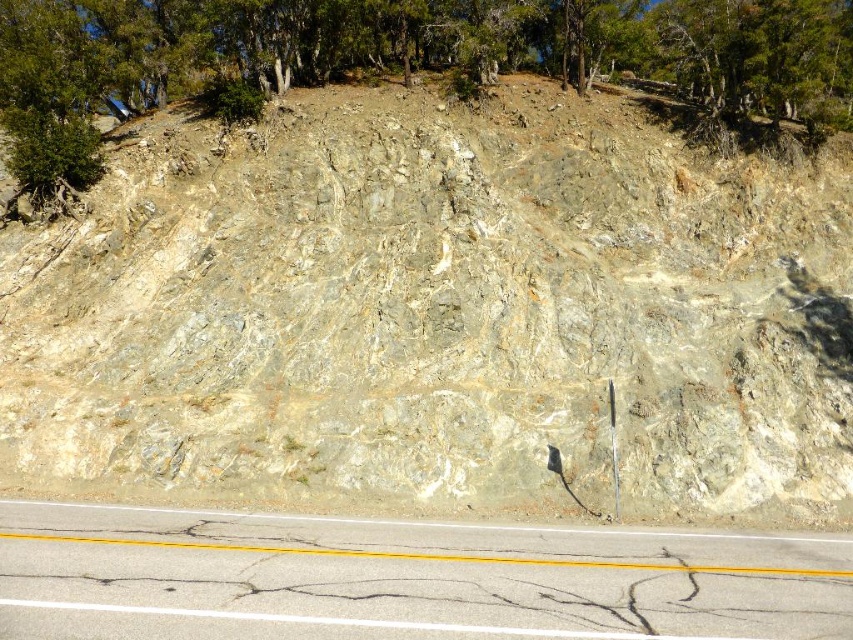
You are a hiker trying to navigate a rocky hillside. You see a gray rock at center and a green leafy tree at upper center. Which object is closer to the left side of the path?

The gray rock at center is to the left of the green leafy tree at upper center, so it is closer to the left side of the path.

You are a hiker planning to walk from the gray rock at center to the green leafy tree at upper center. Based on the scene, which direction should you move to reach the tree?

The gray rock at center is in front of the green leafy tree at upper center, so to reach the tree, you should move backward or away from the rock towards the upper part of the scene.